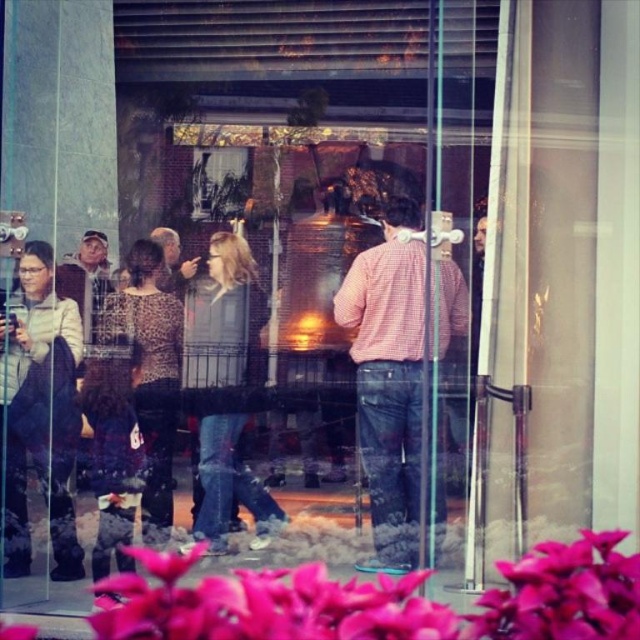
You are standing outside the glass window and want to take a photo of the matte gray jacket at left without including the camera reflection. Can you move closer to the jacket to avoid the reflection?

The matte gray jacket at left and camera are 4.00 meters apart from each other. Since you are outside the window, moving closer to the jacket would bring you closer to the camera reflection, making it harder to avoid. You might need to adjust your angle instead of distance to exclude the reflection.

From the picture: You are a photographer standing outside a store with a glass window. You notice two people inside through the reflection. The first person is wearing a pink checkered shirt at center, and the second is wearing a matte black jacket at left. Based on their positions in the reflection, which clothing item is closer to the bottom of the window?

The pink checkered shirt at center is closer to the bottom of the window because it is positioned below the matte black jacket at left.

You are a delivery person standing outside the glass window. You see the pink checkered shirt at center and the matte black jacket at left inside the store. Your delivery needs to go to the person closest to the entrance. Which person should you approach?

The pink checkered shirt at center is 4.15 feet away from the matte black jacket at left. Since the entrance location isn not specified, it is impossible to determine which is closer to the entrance. Please provide more information.